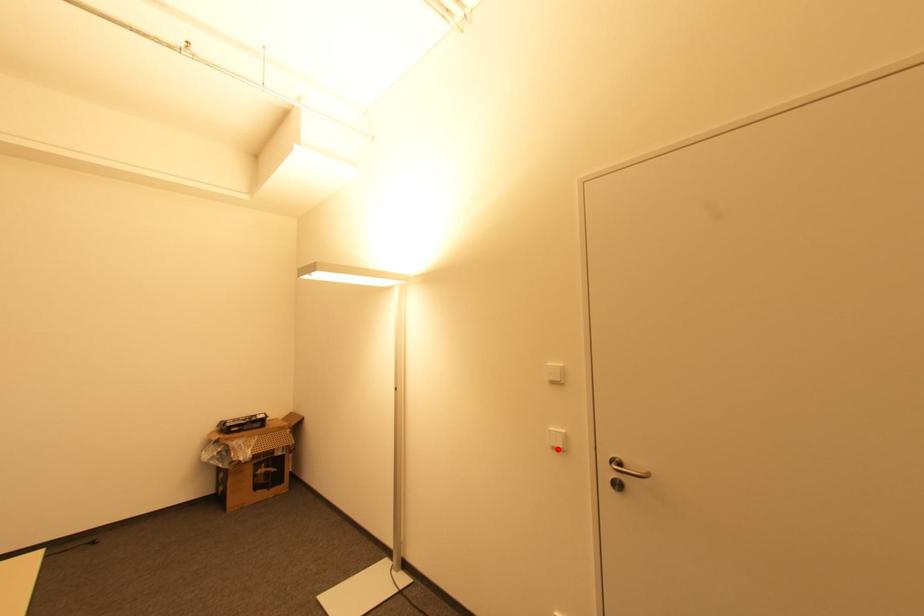
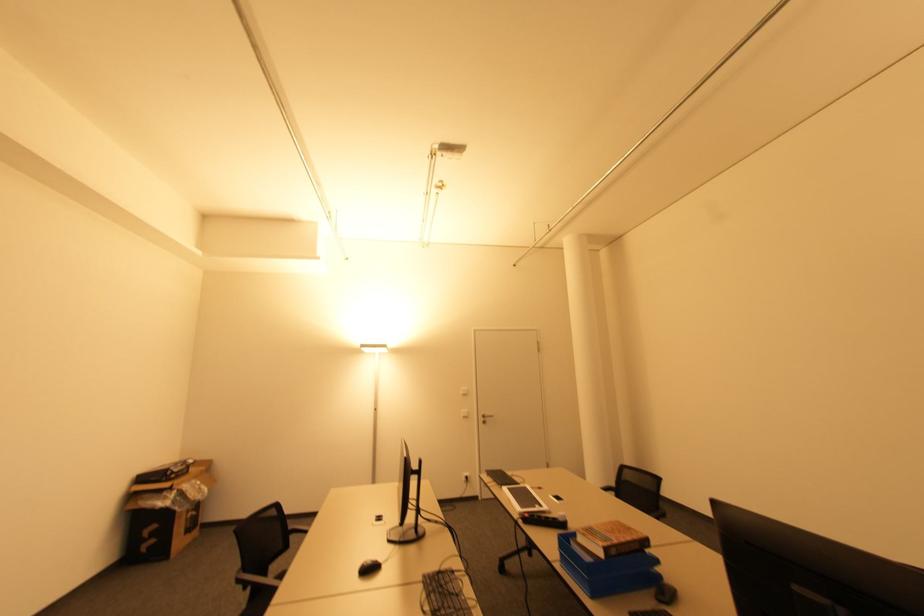
Question: A red point is marked in image1. In image2, is the corresponding 3D point closer to the camera or farther? Reply with the corresponding letter.

Choices:
 (A) The corresponding 3D point is closer.
 (B) The corresponding 3D point is farther.

Answer: (B)